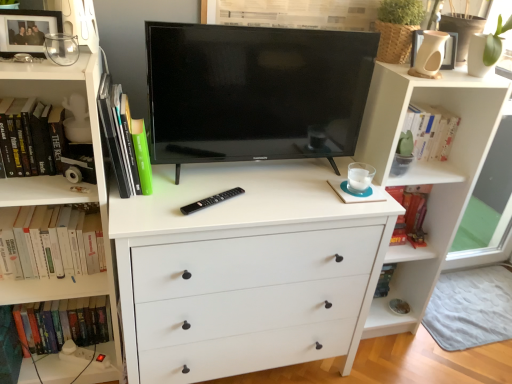
Image resolution: width=512 pixels, height=384 pixels. I want to click on free space that is in between black plastic remote control at center and black glossy tv at center, so click(x=239, y=191).